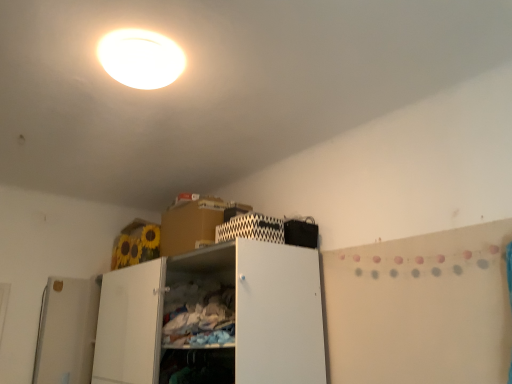
Question: Can you confirm if white glossy ceiling light at upper center is taller than white matte cabinet at center?

Choices:
 (A) no
 (B) yes

Answer: (A)

Question: Can you confirm if white glossy ceiling light at upper center is smaller than white matte cabinet at center?

Choices:
 (A) yes
 (B) no

Answer: (A)

Question: From the image's perspective, is white glossy ceiling light at upper center above white matte cabinet at center?

Choices:
 (A) no
 (B) yes

Answer: (B)

Question: From a real-world perspective, is white glossy ceiling light at upper center physically above white matte cabinet at center?

Choices:
 (A) no
 (B) yes

Answer: (B)

Question: Is white glossy ceiling light at upper center shorter than white matte cabinet at center?

Choices:
 (A) no
 (B) yes

Answer: (B)

Question: Is black zigzag-patterned cabinet at upper center wider or thinner than white glossy ceiling light at upper center?

Choices:
 (A) thin
 (B) wide

Answer: (A)

Question: Is black zigzag-patterned cabinet at upper center inside the boundaries of white glossy ceiling light at upper center, or outside?

Choices:
 (A) outside
 (B) inside

Answer: (A)

Question: Does point (278, 228) appear closer or farther from the camera than point (136, 74)?

Choices:
 (A) farther
 (B) closer

Answer: (A)

Question: Is black zigzag-patterned cabinet at upper center in front of or behind white glossy ceiling light at upper center in the image?

Choices:
 (A) front
 (B) behind

Answer: (B)

Question: From their relative heights in the image, would you say white glossy ceiling light at upper center is taller or shorter than white matte cabinet at center?

Choices:
 (A) tall
 (B) short

Answer: (B)

Question: Is point (133, 64) positioned closer to the camera than point (285, 258)?

Choices:
 (A) closer
 (B) farther

Answer: (A)

Question: In the image, is white glossy ceiling light at upper center on the left side or the right side of white matte cabinet at center?

Choices:
 (A) right
 (B) left

Answer: (A)

Question: Based on their sizes in the image, would you say white glossy ceiling light at upper center is bigger or smaller than white matte cabinet at center?

Choices:
 (A) big
 (B) small

Answer: (B)

Question: Based on their positions, is white glossy ceiling light at upper center located to the left or right of black zigzag-patterned cabinet at upper center?

Choices:
 (A) left
 (B) right

Answer: (A)

Question: From the image's perspective, is white glossy ceiling light at upper center located above or below black zigzag-patterned cabinet at upper center?

Choices:
 (A) below
 (B) above

Answer: (B)